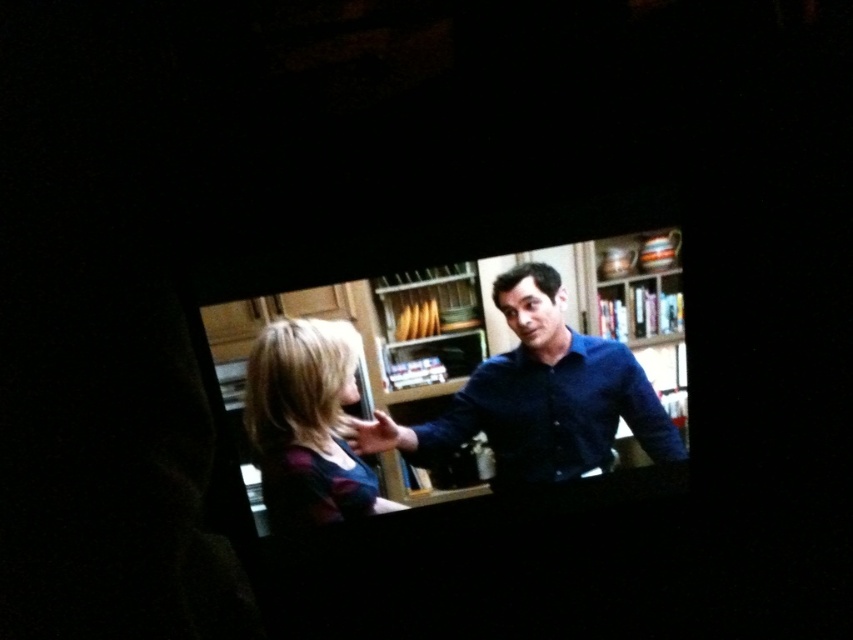
You are a photographer trying to capture a closeup of both the dark blue shirt at center and the matte black shirt at lower left in the TV screen. The camera lens has a maximum focus range of 8 inches. Can you focus on both shirts simultaneously without refocusing?

The distance between the dark blue shirt at center and matte black shirt at lower left is 8.23 inches. Since the camera lens can only focus within 8 inches, you cannot focus on both shirts at the same time without refocusing.

You are designing a new sitcom scene and want to ensure the actors are positioned correctly based on their clothing sizes. Given the dark blue shirt at center and the matte black shirt at lower left, which shirt should be placed closer to the camera to maintain the size difference shown in the scene?

The dark blue shirt at center should be placed closer to the camera because it is larger in size compared to the matte black shirt at lower left, which would naturally appear smaller when positioned farther away.

You are watching a TV show and see the image described. The TV screen has a coordinate system where the bottom left corner is the origin. The dark blue shirt at center is marked by a point at coordinate (538, 397). If you want to point to the dark blue shirt at center on the screen, which direction should you move from the bottom left corner of the TV screen?

To point to the dark blue shirt at center marked by the coordinate (538, 397), you should move 62.2 percent to the right and 63.2 percent upwards from the bottom left corner of the TV screen.